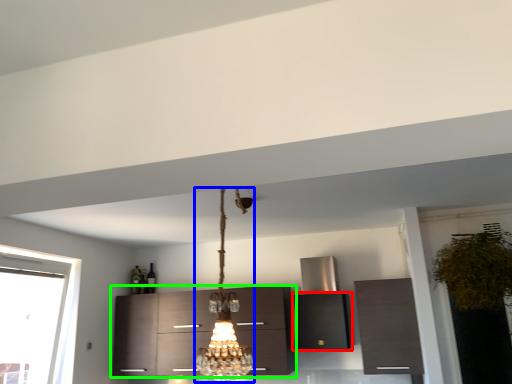
Question: Which is farther away from cabinetry (highlighted by a red box)? lamp (highlighted by a blue box) or cabinetry (highlighted by a green box)?

Choices:
 (A) lamp
 (B) cabinetry

Answer: (A)